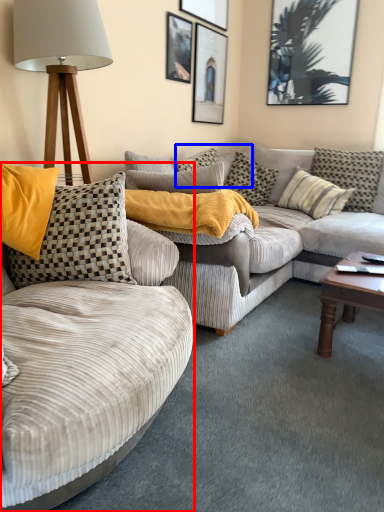
Question: Among these objects, which one is nearest to the camera, studio couch (highlighted by a red box) or pillow (highlighted by a blue box)?

Choices:
 (A) studio couch
 (B) pillow

Answer: (A)